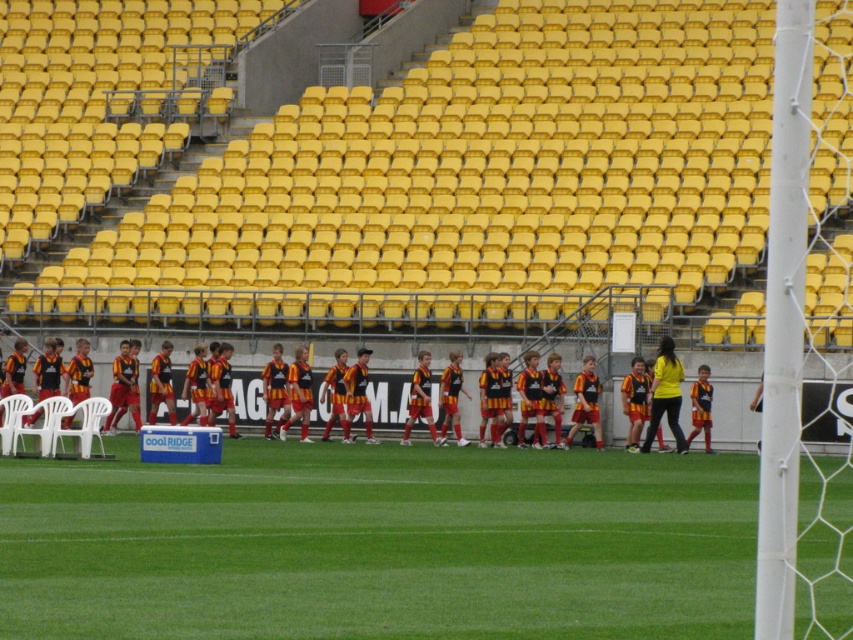
You are a photographer standing behind the soccer team. You want to take a photo of the green grass at center and the black jersey at center. Which object is closer to the camera?

The black jersey at center is closer to the camera because it is positioned over the green grass at center, indicating it is in front.

You are a photographer standing at the center of the soccer field. You want to take a photo that includes both the point at coordinates point (448, 474) and point (383, 419). Based on their positions, which point should you focus on first to ensure both are in frame?

Point (448, 474) is in front of point (383, 419), so you should focus on point (383, 419) first to ensure both are in frame.

You are a photographer positioned at the back of the field. You want to take a photo of the black jersey at center without the green grass at center blocking it. How can you adjust your position to achieve this?

Since the green grass at center is in front of the black jersey at center, you should move to a position behind the black jersey at center so that the grass is no longer blocking the view.